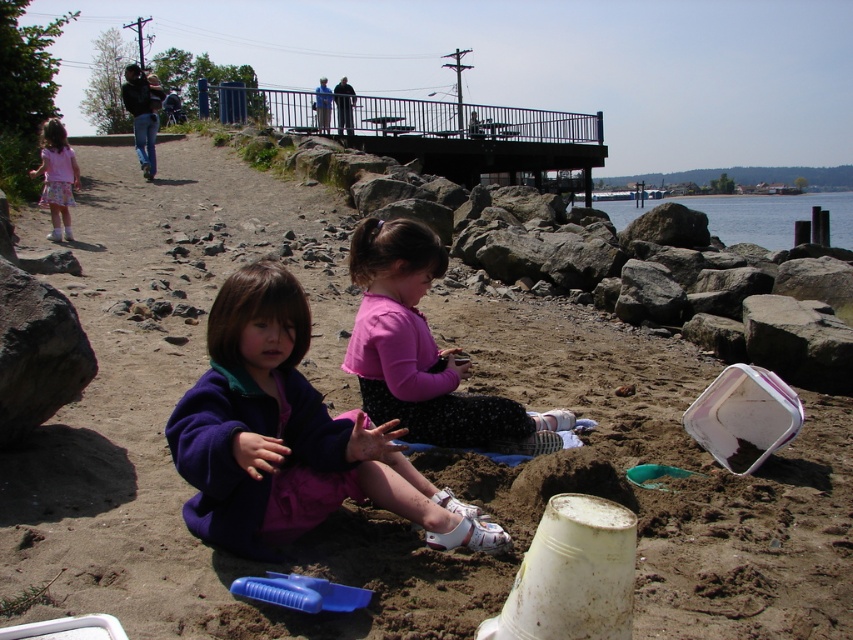
In the scene shown: You are a parent looking for your children in the sand area. You see the purple fleece jacket at center and the matte pink dress at left. Which child is sitting to the left of the other?

The purple fleece jacket at center is to the right of the matte pink dress at left, so the child in the matte pink dress at left is sitting to the left of the child in the purple fleece jacket at center.

Consider the image. You are standing at the center of the image and want to reach the clear water at lower right. Which direction should you move to get there?

You should move towards the lower right direction to reach the clear water at lower right, as it is located at point (751,216).